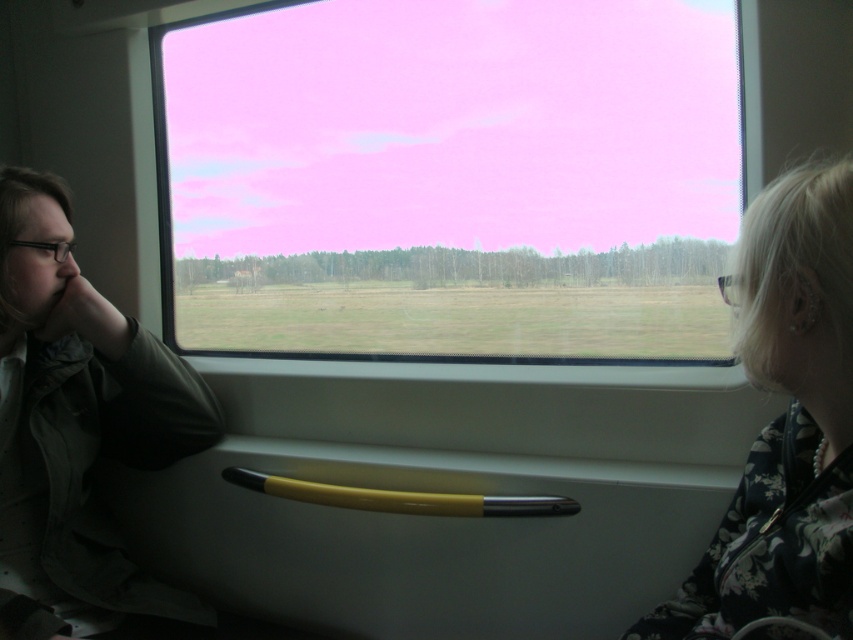
You are sitting in a train carriage and looking out the window. You notice two passengers seated in front of you. One is wearing a matte green jacket at left and the other a floral fabric jacket at right. From your perspective, which jacket is positioned farther to the left?

The matte green jacket at left is positioned farther to the left than the floral fabric jacket at right.